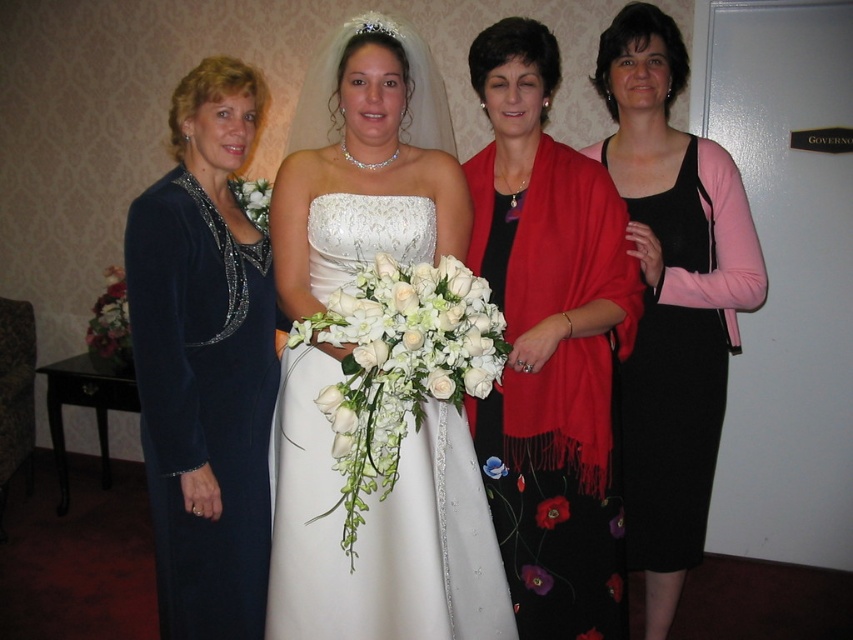
Question: Which point is farther to the camera?

Choices:
 (A) (660, 435)
 (B) (235, 182)
 (C) (364, 257)

Answer: (A)

Question: Is black velvet dress at center to the left of black satin dress at right from the viewer's perspective?

Choices:
 (A) yes
 (B) no

Answer: (B)

Question: Can you confirm if black velvet dress at center is bigger than white floral bouquet at center?

Choices:
 (A) no
 (B) yes

Answer: (B)

Question: Considering the real-world distances, which object is farthest from the white floral bouquet at center?

Choices:
 (A) black velvet dress at center
 (B) black floral dress at center

Answer: (A)

Question: Among these points, which one is nearest to the camera?

Choices:
 (A) (628, 474)
 (B) (457, 401)
 (C) (248, 200)
 (D) (440, 244)

Answer: (B)

Question: Is dark blue velvet dress at left above black satin dress at right?

Choices:
 (A) yes
 (B) no

Answer: (A)